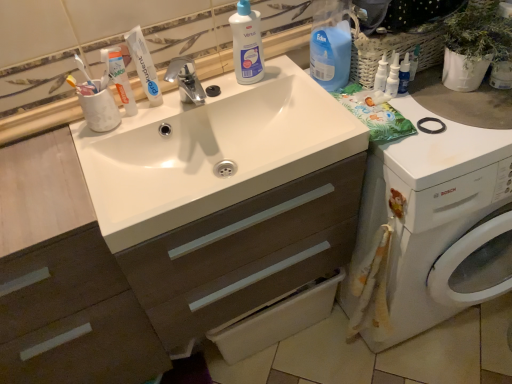
The width and height of the screenshot is (512, 384). Find the location of `empty space that is to the right of white glossy spray bottle at upper right, positioned as the second cleaning product in right-to-left order`. empty space that is to the right of white glossy spray bottle at upper right, positioned as the second cleaning product in right-to-left order is located at coordinates (443, 96).